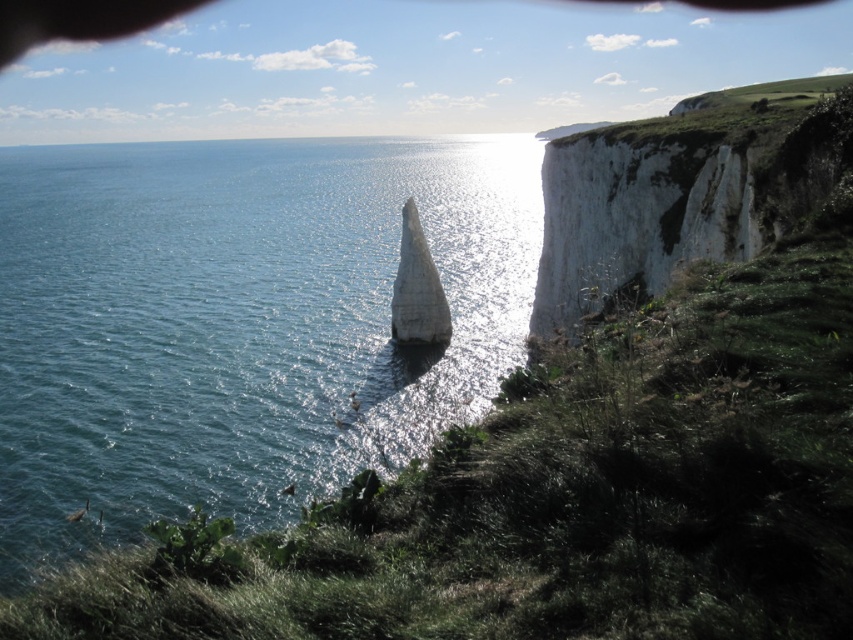
You are a drone operator trying to capture the white chalk stack in the center of the image. The drone is currently hovering at point (239, 323). Is this point above or below the blue water at center?

The blue water at center is located at point (239, 323), so the drone is exactly at the same position as the blue water at center. Therefore, the drone is not above or below but precisely at the location of the blue water at center.

You are a photographer planning to capture the white rocky cliff at upper right and the blue water at center in a single shot. Based on their heights, which one should you focus on to ensure both are visible in the frame?

The blue water at center has a greater height compared to the white rocky cliff at upper right, so focusing on the blue water at center will ensure both are visible since it occupies more vertical space.

You are a photographer trying to capture the white rocky cliff at upper right and the blue water at center in a single shot. Based on their positions, which object should you frame first to ensure both are in the same photo?

You should frame the white rocky cliff at upper right first because the blue water at center is to the left of it, meaning the cliff is positioned to the right side of the water. By starting with the cliff, you can adjust the camera angle to include the water on the left side within the same frame.